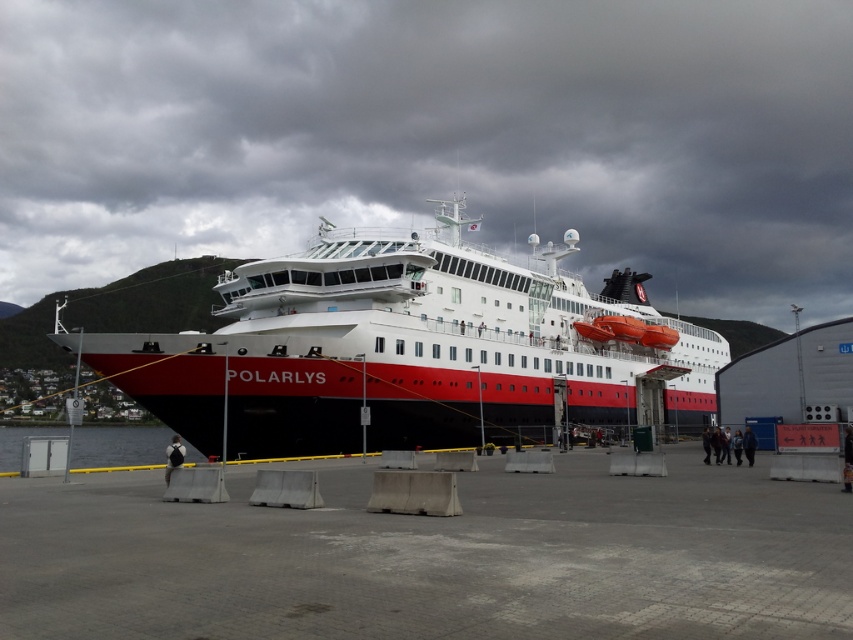
Which is behind, point (260, 371) or point (148, 433)?

Positioned behind is point (148, 433).

Between red matte ship at center and clear water at lower left, which one is positioned lower?

clear water at lower left is below.

Where is `red matte ship at center`? Image resolution: width=853 pixels, height=640 pixels. red matte ship at center is located at coordinates (410, 349).

The width and height of the screenshot is (853, 640). I want to click on red matte ship at center, so pos(410,349).